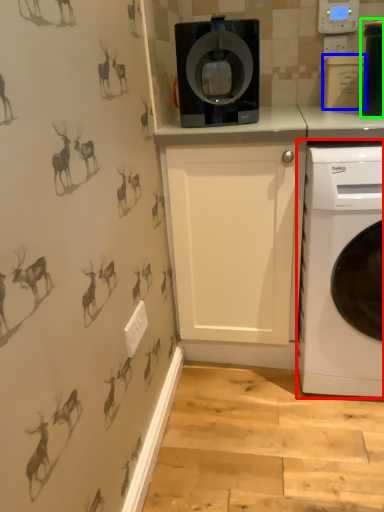
Question: Which object is positioned closest to washing machine (highlighted by a red box)? Select from appliance (highlighted by a blue box) and appliance (highlighted by a green box).

Choices:
 (A) appliance
 (B) appliance

Answer: (B)